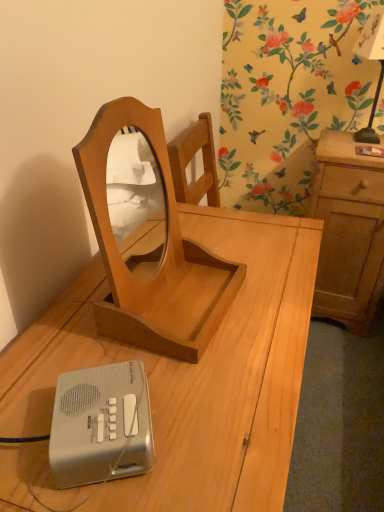
Question: Is point (367, 39) positioned closer to the camera than point (97, 463)?

Choices:
 (A) farther
 (B) closer

Answer: (A)

Question: Is black glass bedside lamp at upper right bigger or smaller than silver plastic ipod at lower left?

Choices:
 (A) big
 (B) small

Answer: (A)

Question: Estimate the real-world distances between objects in this image. Which object is closer to the light brown wood cabinet at right?

Choices:
 (A) black glass bedside lamp at upper right
 (B) light wood desk at center
 (C) silver plastic ipod at lower left

Answer: (A)

Question: Estimate the real-world distances between objects in this image. Which object is farther from the black glass bedside lamp at upper right?

Choices:
 (A) light wood desk at center
 (B) light brown wood cabinet at right
 (C) silver plastic ipod at lower left

Answer: (C)